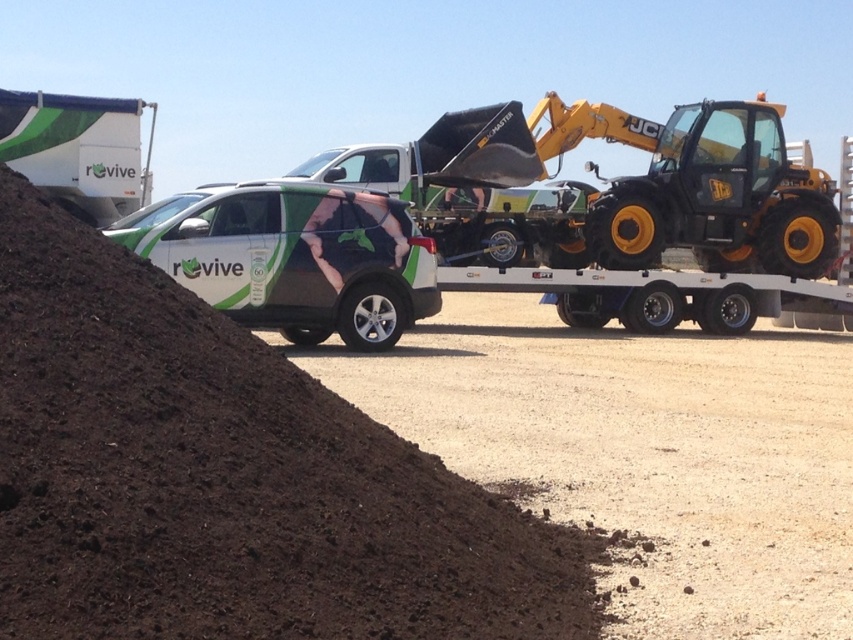
You are a surveyor trying to locate the dark brown soil at lower left in the image. According to the coordinates provided, where exactly is it positioned?

The dark brown soil at lower left is located at point coordinates of (227, 477).

You are a surveyor standing at the point labeled as point [227,477] in the image. Based on the scene description, which object are you currently standing on?

The point [227,477] corresponds to dark brown soil at lower left, so you are standing on the dark brown soil at lower left.

You are standing at the point marked by the coordinates [227,477] in the image, which is on the dark brown soil at lower left. You want to walk towards the white SUV with green and black graphics. Which direction should you head?

The point [227,477] is located on the dark brown soil at lower left. The white SUV with green and black graphics is parked in the midground near a flatbed trailer. To reach the SUV, you should head towards the midground area, which is forward from your current position on the soil.